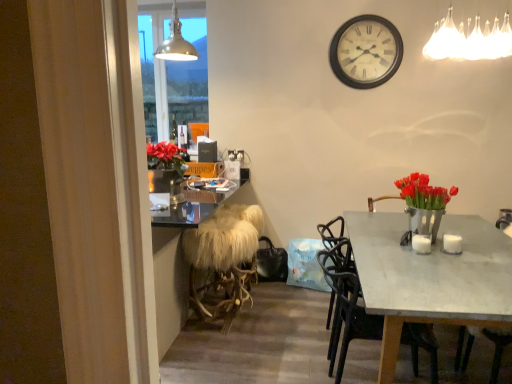
Question: Should I look upward or downward to see white fabric chandelier at upper right, which appears as the second lamp when viewed from the back?

Choices:
 (A) down
 (B) up

Answer: (B)

Question: From a real-world perspective, is white fabric chandelier at upper right, acting as the first lamp starting from the right, on white glossy coffee cup at table right, which is the 1th coffee cup in right-to-left order?

Choices:
 (A) no
 (B) yes

Answer: (B)

Question: Is white fabric chandelier at upper right, which appears as the second lamp when viewed from the back, bigger than white glossy coffee cup at table right, the second coffee cup positioned from the left?

Choices:
 (A) yes
 (B) no

Answer: (A)

Question: From a real-world perspective, is white fabric chandelier at upper right, which is counted as the 1th lamp, starting from the front, located beneath white glossy coffee cup at table right, the second coffee cup positioned from the left?

Choices:
 (A) no
 (B) yes

Answer: (A)

Question: From the image's perspective, would you say white fabric chandelier at upper right, acting as the first lamp starting from the right, is positioned over white glossy coffee cup at table right, which is the 1th coffee cup in right-to-left order?

Choices:
 (A) yes
 (B) no

Answer: (A)

Question: Does white fabric chandelier at upper right, which appears as the second lamp when viewed from the back, come in front of white glossy coffee cup at table right, which is the 1th coffee cup in right-to-left order?

Choices:
 (A) yes
 (B) no

Answer: (A)

Question: Can you confirm if white fabric chandelier at upper right, the 2th lamp viewed from the left, is taller than white glossy coffee cup at table right, which is the 1th coffee cup in right-to-left order?

Choices:
 (A) no
 (B) yes

Answer: (B)

Question: From the image's perspective, is matte black chair at center beneath black leather speaker at upper center?

Choices:
 (A) no
 (B) yes

Answer: (B)

Question: Is matte black chair at center in contact with black leather speaker at upper center?

Choices:
 (A) no
 (B) yes

Answer: (A)

Question: Can you confirm if matte black chair at center is wider than black leather speaker at upper center?

Choices:
 (A) yes
 (B) no

Answer: (A)

Question: Is matte black chair at center oriented towards black leather speaker at upper center?

Choices:
 (A) yes
 (B) no

Answer: (B)

Question: Can you confirm if matte black chair at center is positioned to the left of black leather speaker at upper center?

Choices:
 (A) no
 (B) yes

Answer: (A)

Question: From the image's perspective, would you say matte black chair at center is positioned over black leather speaker at upper center?

Choices:
 (A) no
 (B) yes

Answer: (A)

Question: From the image's perspective, does white fabric chandelier at upper right, which is counted as the 1th lamp, starting from the front, appear lower than metallic pendant light at upper center, the first lamp viewed from the back?

Choices:
 (A) yes
 (B) no

Answer: (A)